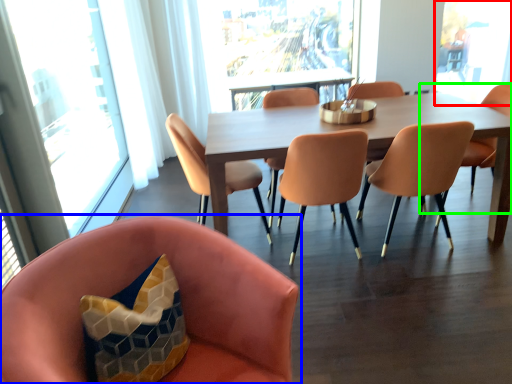
Question: Which is farther away from window screen (highlighted by a red box)? chair (highlighted by a blue box) or chair (highlighted by a green box)?

Choices:
 (A) chair
 (B) chair

Answer: (A)